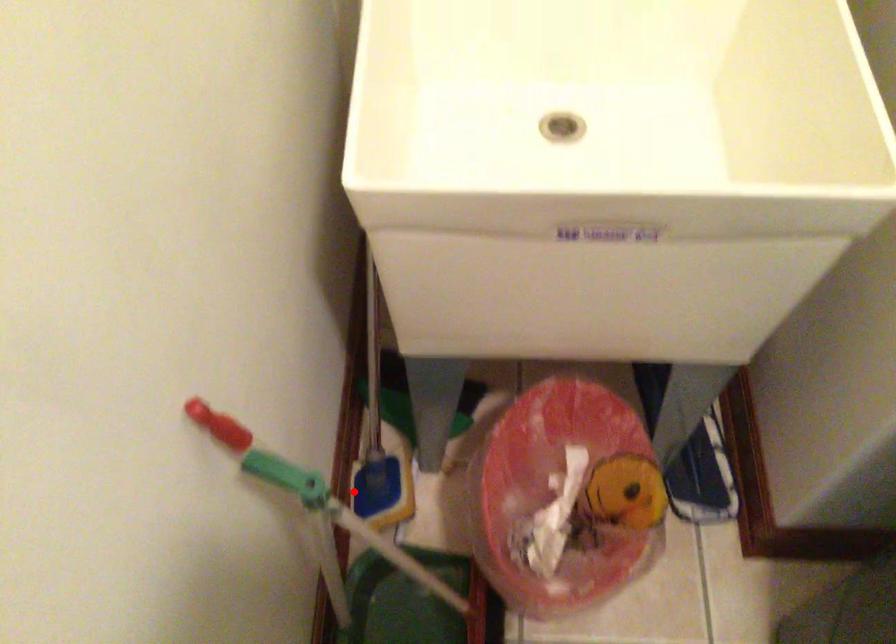
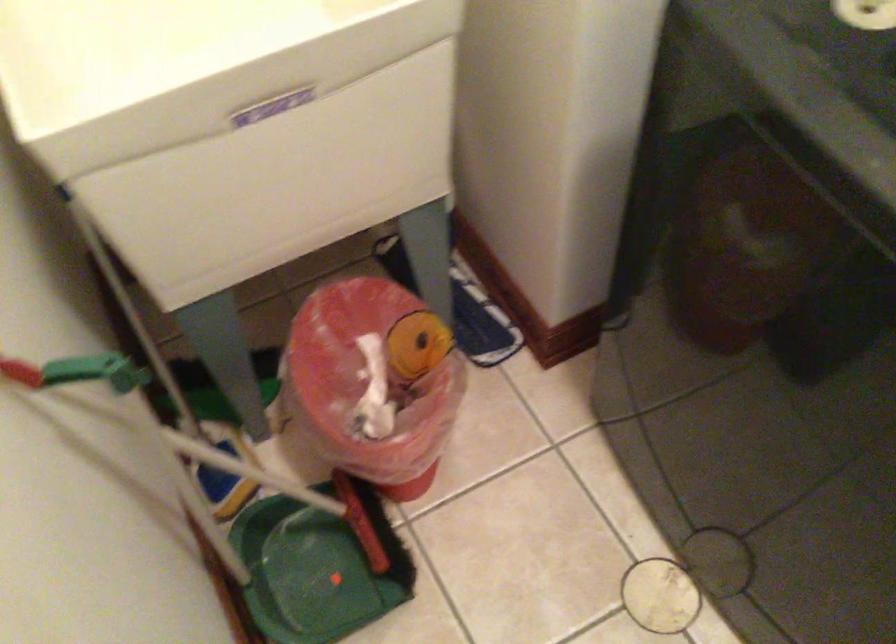
Locate, in the second image, the point that corresponds to the highlighted location in the first image.

(202, 485)